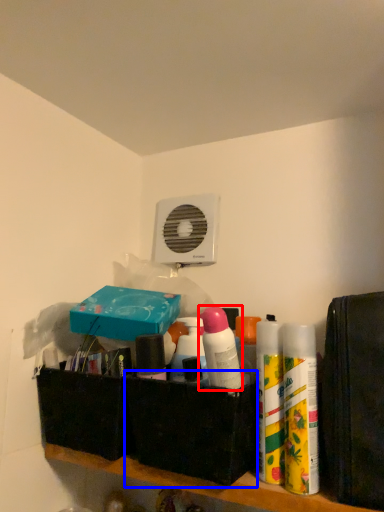
Question: Among these objects, which one is nearest to the camera, cleaning product (highlighted by a red box) or box (highlighted by a blue box)?

Choices:
 (A) cleaning product
 (B) box

Answer: (A)